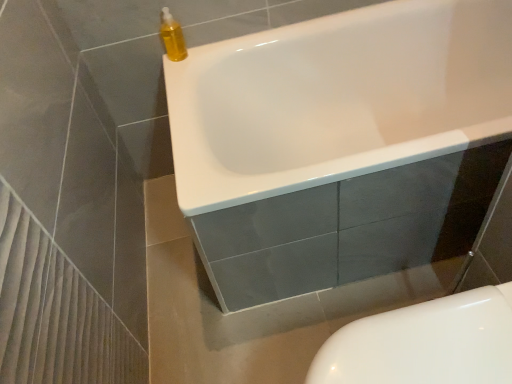
Where is `vacant space in front of yellow translucent bottle at upper left`? Image resolution: width=512 pixels, height=384 pixels. vacant space in front of yellow translucent bottle at upper left is located at coordinates (178, 74).